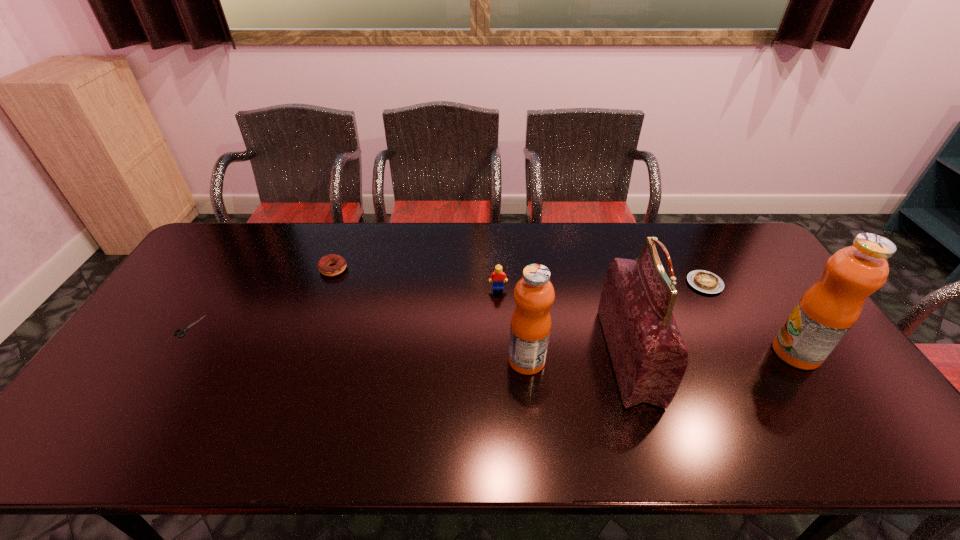
The width and height of the screenshot is (960, 540). Find the location of `the left fruit juice`. the left fruit juice is located at coordinates [534, 294].

Identify the location of the third tallest object. (x=534, y=294).

The height and width of the screenshot is (540, 960). Find the location of `the taller fruit juice`. the taller fruit juice is located at coordinates (825, 313).

Image resolution: width=960 pixels, height=540 pixels. Find the location of `the rightmost object`. the rightmost object is located at coordinates (825, 313).

The image size is (960, 540). Find the location of `the third shortest object`. the third shortest object is located at coordinates (323, 264).

Image resolution: width=960 pixels, height=540 pixels. What are the coordinates of `the second object from left to right` in the screenshot? It's located at (323, 264).

I want to click on Lego, so click(498, 275).

Where is `the second object from right to left`? The height and width of the screenshot is (540, 960). the second object from right to left is located at coordinates (704, 281).

Where is `the second shortest object`? This screenshot has width=960, height=540. the second shortest object is located at coordinates (704, 281).

Find the location of `the shortest object`. the shortest object is located at coordinates (183, 330).